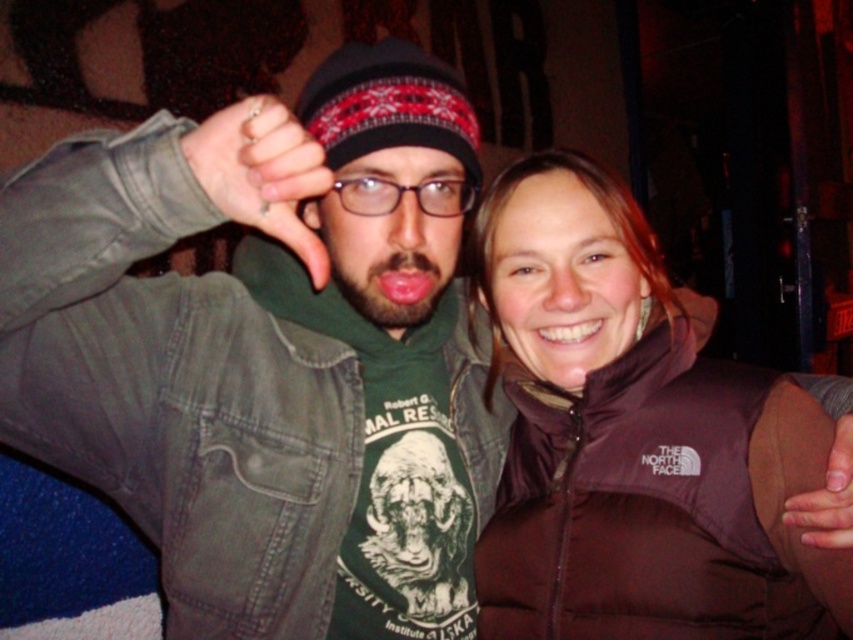
Does sweater knit beanie at center have a greater height compared to brown leather hand at lower right?

Yes, sweater knit beanie at center is taller than brown leather hand at lower right.

Is sweater knit beanie at center positioned at the back of brown leather hand at lower right?

Yes.

Is point (409, 84) positioned behind point (850, 548)?

That is True.

Locate an element on the screen. The image size is (853, 640). sweater knit beanie at center is located at coordinates (387, 104).

Does brown down jacket at center have a greater height compared to matte black thumb at center?

→ Yes, brown down jacket at center is taller than matte black thumb at center.

Can you confirm if brown down jacket at center is positioned above matte black thumb at center?

Actually, brown down jacket at center is below matte black thumb at center.

Who is more distant from viewer, [585,333] or [247,184]?

Point [585,333]

What are the coordinates of `brown down jacket at center` in the screenshot? It's located at (635, 438).

Between point (704, 401) and point (850, 483), which one is positioned in front?

Positioned in front is point (850, 483).

Is point (622, 532) closer to camera compared to point (799, 532)?

No, (622, 532) is further to viewer.

Where is `brown down jacket at center`? brown down jacket at center is located at coordinates (635, 438).